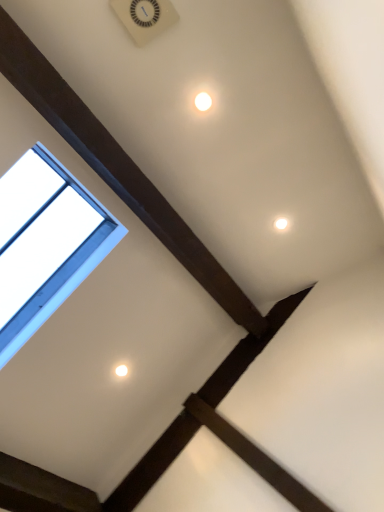
Question: Is white glossy light at upper center at the back of transparent glass window at upper left?

Choices:
 (A) yes
 (B) no

Answer: (B)

Question: Considering the relative sizes of transparent glass window at upper left and white glossy light at upper center in the image provided, is transparent glass window at upper left smaller than white glossy light at upper center?

Choices:
 (A) no
 (B) yes

Answer: (A)

Question: Does transparent glass window at upper left appear on the left side of white glossy light at upper center?

Choices:
 (A) no
 (B) yes

Answer: (B)

Question: Does transparent glass window at upper left have a greater width compared to white glossy light at upper center?

Choices:
 (A) no
 (B) yes

Answer: (B)

Question: Considering the relative sizes of transparent glass window at upper left and white glossy light at upper center in the image provided, is transparent glass window at upper left shorter than white glossy light at upper center?

Choices:
 (A) yes
 (B) no

Answer: (B)

Question: Does transparent glass window at upper left have a larger size compared to white glossy light at upper center?

Choices:
 (A) no
 (B) yes

Answer: (B)

Question: Is transparent glass window at upper left inside white glossy light at upper center?

Choices:
 (A) yes
 (B) no

Answer: (B)

Question: Is white glossy light at upper center bigger than transparent glass window at upper left?

Choices:
 (A) yes
 (B) no

Answer: (B)

Question: Does white glossy light at upper center come behind transparent glass window at upper left?

Choices:
 (A) yes
 (B) no

Answer: (A)

Question: Does white glossy light at upper center have a smaller size compared to transparent glass window at upper left?

Choices:
 (A) yes
 (B) no

Answer: (A)

Question: Is white glossy light at upper center positioned in front of transparent glass window at upper left?

Choices:
 (A) yes
 (B) no

Answer: (B)

Question: Is white glossy light at upper center facing towards transparent glass window at upper left?

Choices:
 (A) yes
 (B) no

Answer: (A)

Question: Considering their positions, is white glossy light at upper center located in front of or behind transparent glass window at upper left?

Choices:
 (A) front
 (B) behind

Answer: (B)